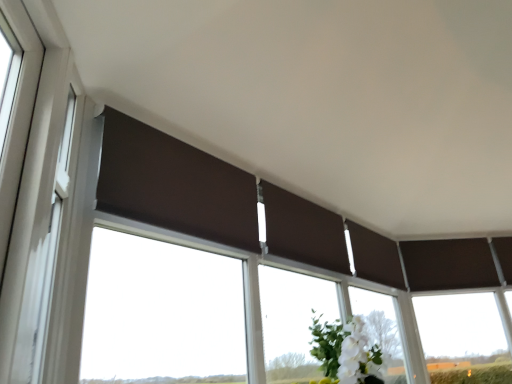
Question: Is white plastic window frame at left smaller than brown fabric window at center?

Choices:
 (A) yes
 (B) no

Answer: (A)

Question: Is white plastic window frame at left at the right side of brown fabric window at center?

Choices:
 (A) no
 (B) yes

Answer: (A)

Question: Is white plastic window frame at left thinner than brown fabric window at center?

Choices:
 (A) no
 (B) yes

Answer: (B)

Question: From the image's perspective, is white plastic window frame at left on brown fabric window at center?

Choices:
 (A) yes
 (B) no

Answer: (A)

Question: Is brown fabric window at center surrounded by white plastic window frame at left?

Choices:
 (A) yes
 (B) no

Answer: (B)

Question: Would you say white plastic window frame at left is outside brown fabric window at center?

Choices:
 (A) yes
 (B) no

Answer: (A)

Question: Does brown fabric window at center come behind white plastic window frame at left?

Choices:
 (A) yes
 (B) no

Answer: (A)

Question: Would you say brown fabric window at center is outside white plastic window frame at left?

Choices:
 (A) no
 (B) yes

Answer: (B)

Question: Is brown fabric window at center with white plastic window frame at left?

Choices:
 (A) yes
 (B) no

Answer: (B)

Question: Can you confirm if brown fabric window at center is thinner than white plastic window frame at left?

Choices:
 (A) yes
 (B) no

Answer: (B)

Question: Is brown fabric window at center bigger than white plastic window frame at left?

Choices:
 (A) no
 (B) yes

Answer: (B)

Question: From a real-world perspective, does brown fabric window at center sit lower than white plastic window frame at left?

Choices:
 (A) no
 (B) yes

Answer: (B)

Question: From the image's perspective, is white plastic window frame at left positioned above or below brown fabric window at center?

Choices:
 (A) below
 (B) above

Answer: (B)